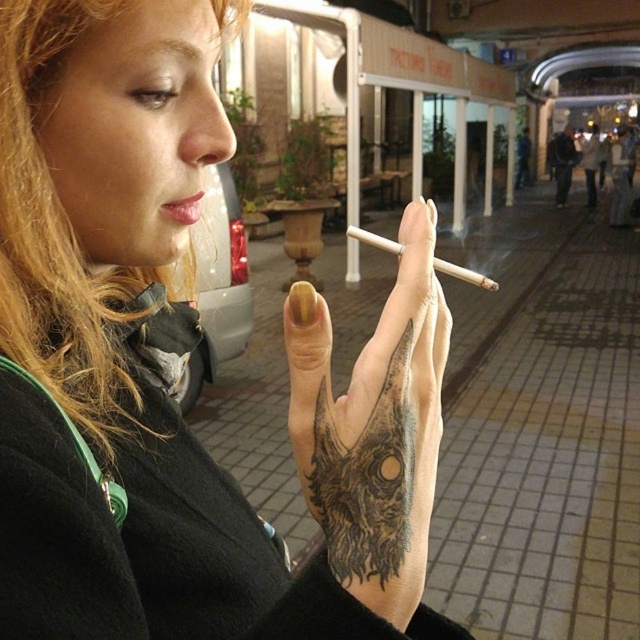
Based on the photo, based on the scene description, where is the black ink tattoo at center located in relation to the cigarette?

The black ink tattoo at center is located at point (365, 476), which is to the right of the cigarette in the image.

You are a photographer aiming to capture a portrait of the subject. You want to ensure that both the black tattooed hand at center and the pink matte lips at center are clearly visible in the frame. Based on their positions, which object should be placed closer to the camera to ensure both are in focus?

The black tattooed hand at center is positioned on the right side of pink matte lips at center. To ensure both are in focus, the photographer should position the camera so that the black tattooed hand at center and the pink matte lips at center are aligned along the same focal plane. Since they are positioned side by side, adjusting the focus to include both should be achievable by focusing on the midpoint between them.

You are a makeup artist observing the person in the image. You need to apply lipstick to the pink matte lips at center without accidentally marking the black matte tattoo at center. Based on their positions, which direction should you avoid applying lipstick?

The black matte tattoo at center is located below the pink matte lips at center. To avoid marking it, you should avoid applying lipstick downward from the lips.